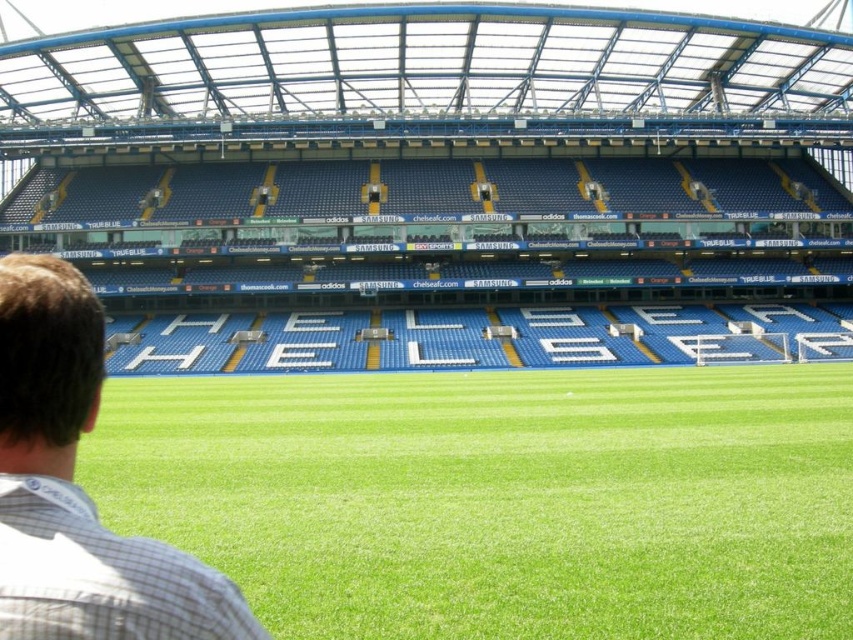
Question: Can you confirm if green grass at center is bigger than brown checkered shirt at lower left?

Choices:
 (A) yes
 (B) no

Answer: (A)

Question: Which object is closer to the camera taking this photo?

Choices:
 (A) green grass at center
 (B) brown checkered shirt at lower left

Answer: (B)

Question: Does green grass at center appear over brown checkered shirt at lower left?

Choices:
 (A) no
 (B) yes

Answer: (A)

Question: In this image, where is green grass at center located relative to brown checkered shirt at lower left?

Choices:
 (A) above
 (B) below

Answer: (B)